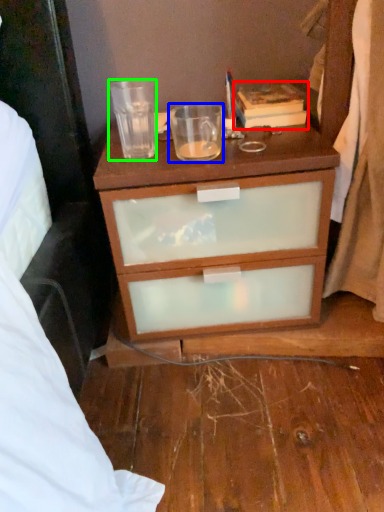
Question: Based on their relative distances, which object is nearer to book (highlighted by a red box)? Choose from coffee cup (highlighted by a blue box) and coffee cup (highlighted by a green box).

Choices:
 (A) coffee cup
 (B) coffee cup

Answer: (A)